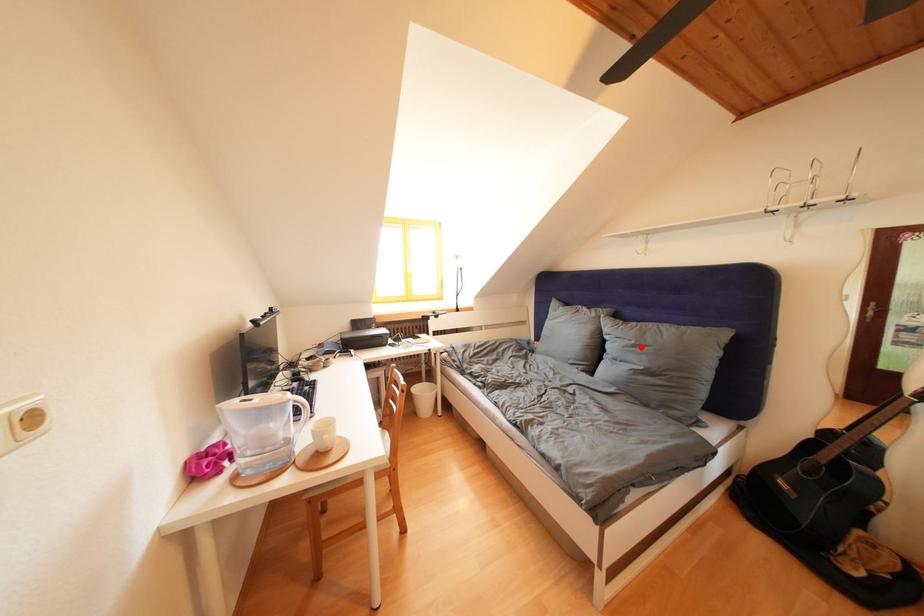
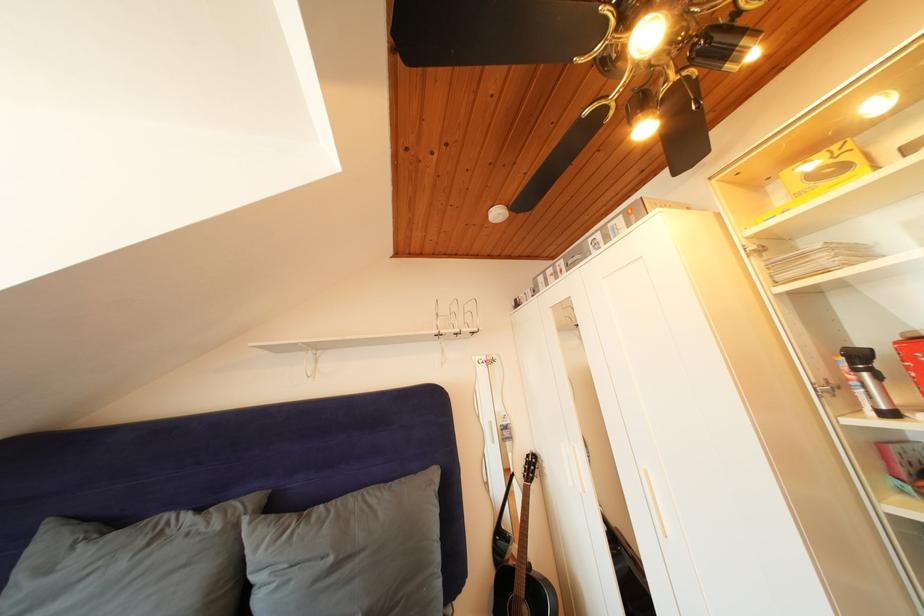
Locate, in the second image, the point that corresponds to the highlighted location in the first image.

(338, 565)